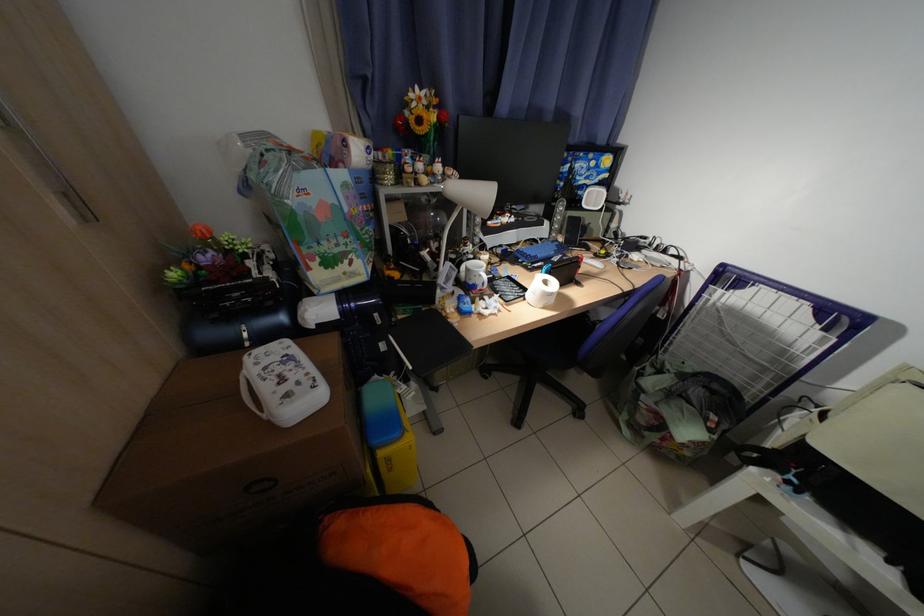
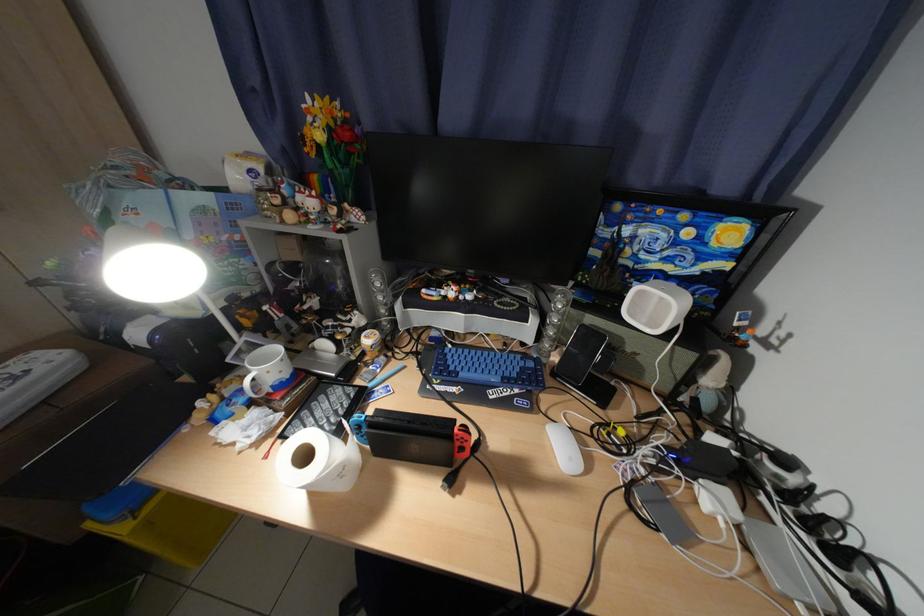
Find the pixel in the second image that matches point (557, 237) in the first image.

(541, 342)